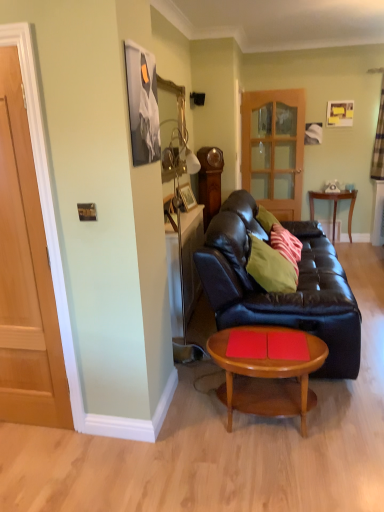
Question: Considering their positions, is green matte pillow at center, which is counted as the 1th pillow, starting from the back, located in front of or behind translucent wooden door at center?

Choices:
 (A) front
 (B) behind

Answer: (A)

Question: From a real-world perspective, is green matte pillow at center, which ranks as the second pillow in front-to-back order, physically located above or below translucent wooden door at center?

Choices:
 (A) below
 (B) above

Answer: (A)

Question: Which object is the closest to the green matte pillow at center, which ranks as the second pillow in front-to-back order?

Choices:
 (A) wooden side table at right
 (B) matte black leather couch at center
 (C) wooden door at left
 (D) metallic silver picture frame at upper left
 (E) white sheer curtain at upper right

Answer: (B)

Question: Estimate the real-world distances between objects in this image. Which object is farther from the light brown wooden coffee table at center?

Choices:
 (A) translucent wooden door at center
 (B) green matte pillow at center, the second pillow positioned from the back
 (C) green matte pillow at center, which is counted as the 1th pillow, starting from the back
 (D) wooden door at left
 (E) metallic silver picture frame at upper left

Answer: (A)